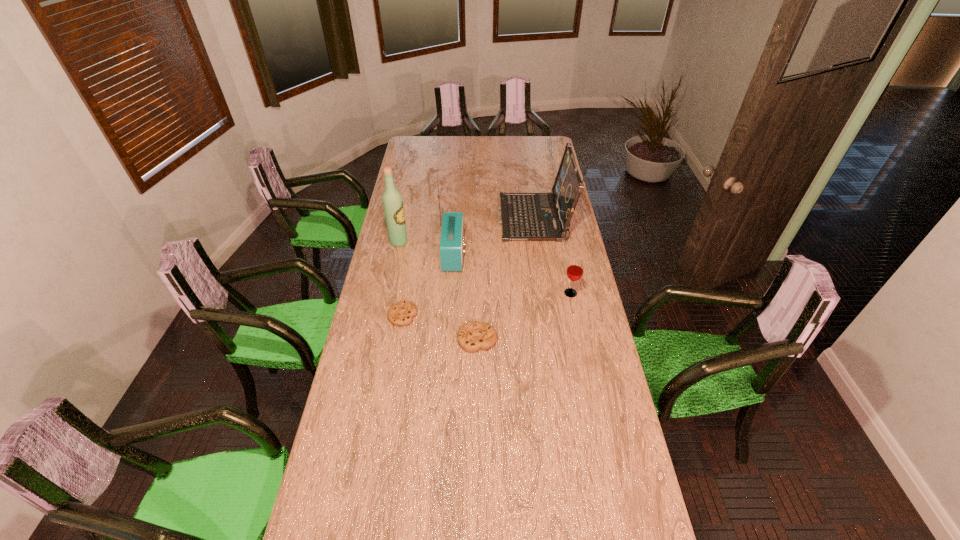
The image size is (960, 540). What are the coordinates of `vacant space that satisfies the following two spatial constraints: 1. on the front-facing side of the wine bottle; 2. on the back side of the shortest object` in the screenshot? It's located at (384, 315).

Locate an element on the screen. free region that satisfies the following two spatial constraints: 1. on the front-facing side of the wine bottle; 2. on the left side of the right cookie is located at coordinates (379, 339).

Where is `vacant area that satisfies the following two spatial constraints: 1. on the front-facing side of the right cookie; 2. on the right side of the wine bottle`? vacant area that satisfies the following two spatial constraints: 1. on the front-facing side of the right cookie; 2. on the right side of the wine bottle is located at coordinates (379, 339).

The image size is (960, 540). In order to click on vacant area in the image that satisfies the following two spatial constraints: 1. on the front-facing side of the laptop computer; 2. on the right side of the third nearest object in this screenshot , I will do `click(545, 293)`.

Image resolution: width=960 pixels, height=540 pixels. I want to click on free space that satisfies the following two spatial constraints: 1. on the front panel of the fifth tallest object; 2. on the right side of the radio receiver, so click(x=447, y=339).

The height and width of the screenshot is (540, 960). I want to click on vacant position in the image that satisfies the following two spatial constraints: 1. on the front-facing side of the third tallest object; 2. on the front side of the left cookie, so click(548, 315).